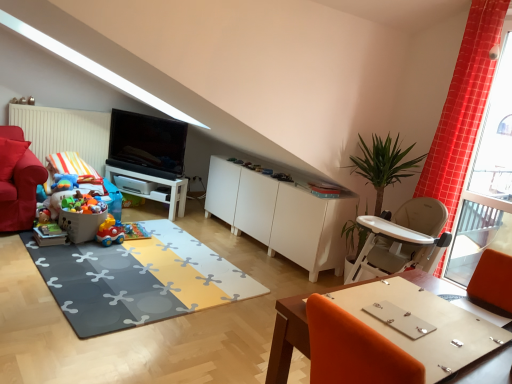
The image size is (512, 384). In order to click on vacant area that is situated to the right of plastic toy car at lower left, the second toy positioned from the top in this screenshot , I will do `click(118, 247)`.